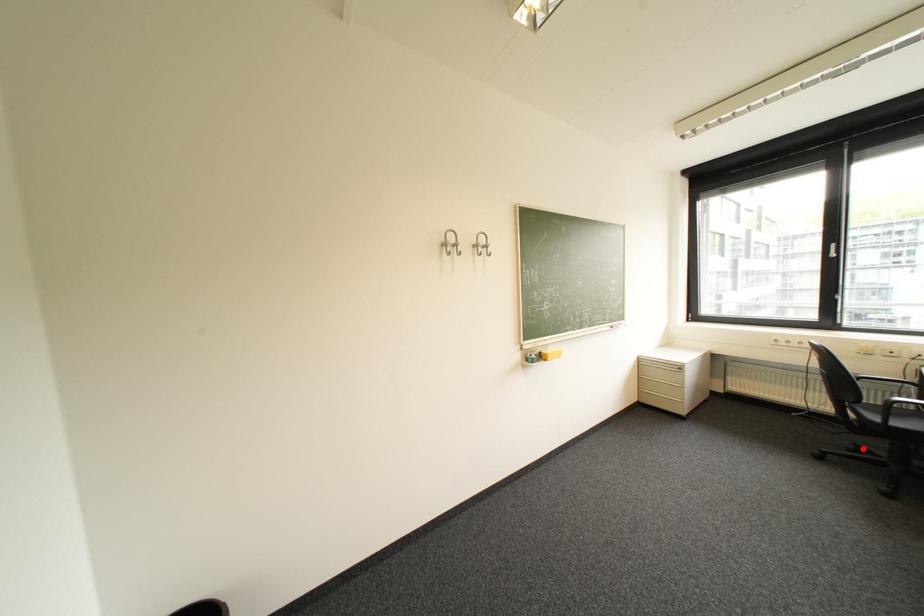
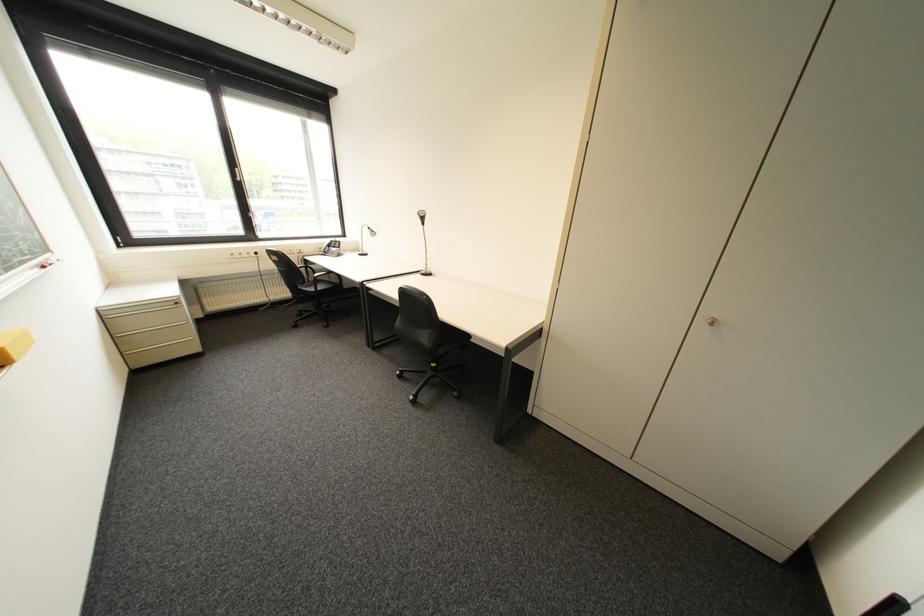
Locate, in the second image, the point that corresponds to the highlighted location in the first image.

(309, 314)